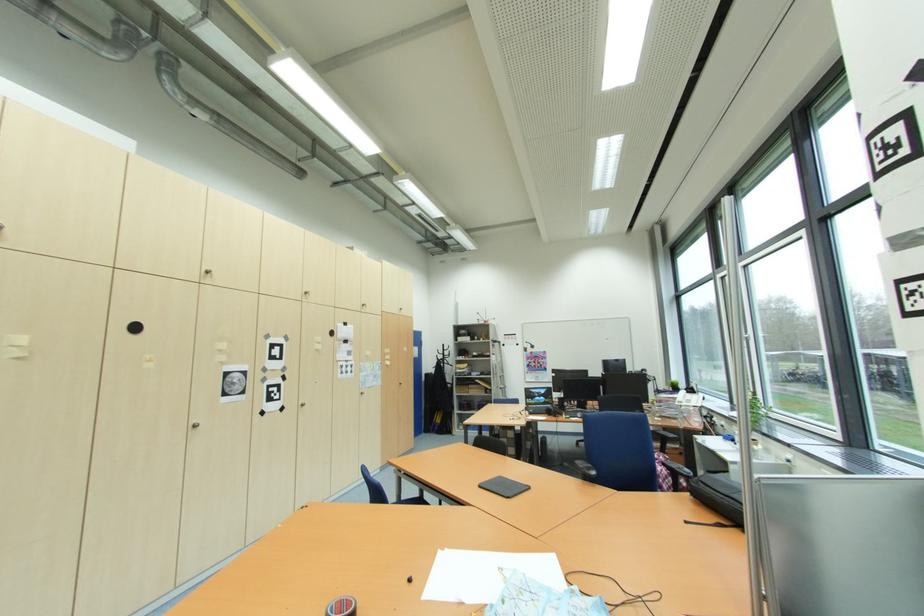
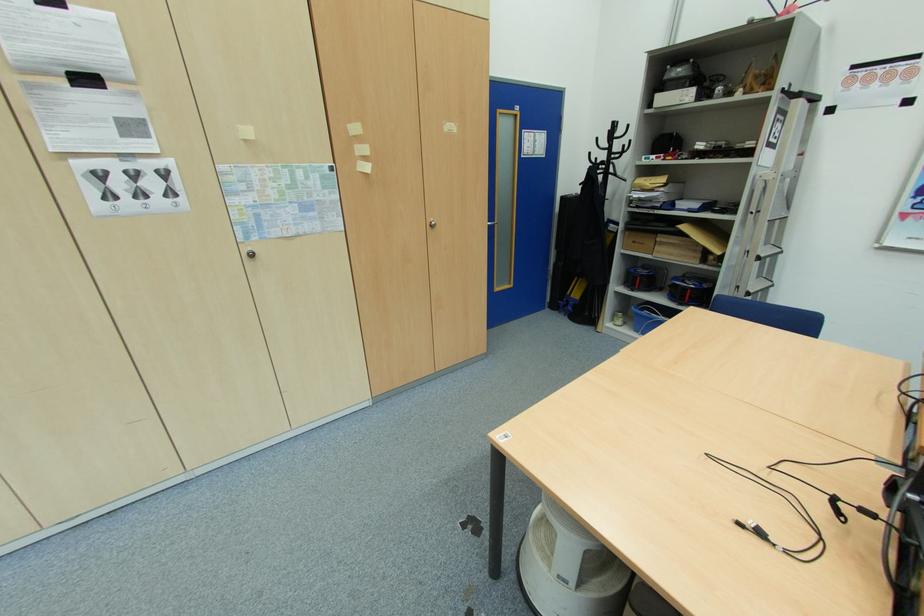
In the second image, find the point that corresponds to the point at 450,363 in the first image.

(614, 169)